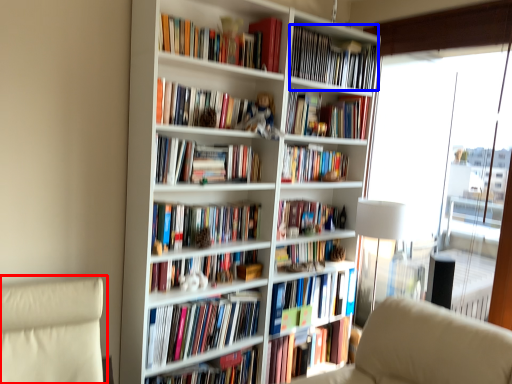
Question: Which object is further to the camera taking this photo, swivel chair (highlighted by a red box) or book (highlighted by a blue box)?

Choices:
 (A) swivel chair
 (B) book

Answer: (B)